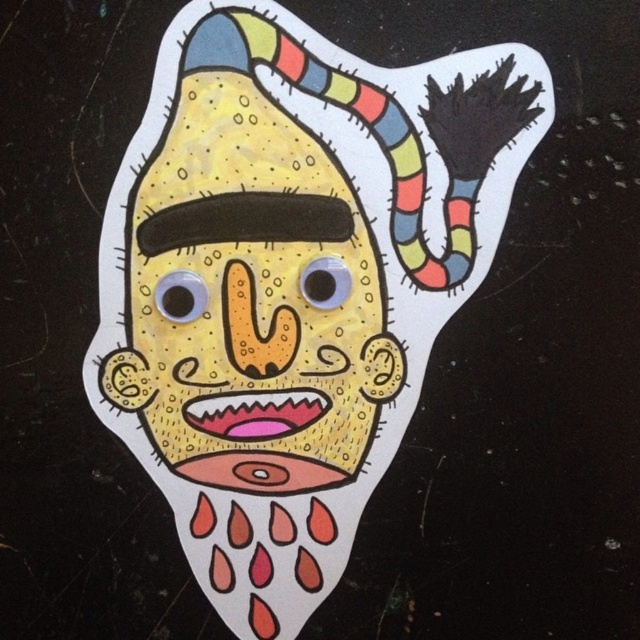
Question: Which object is closer to the camera taking this photo?

Choices:
 (A) yellow textured face at center
 (B) matte yellow mask at center

Answer: (B)

Question: Does matte yellow mask at center have a larger size compared to yellow textured face at center?

Choices:
 (A) no
 (B) yes

Answer: (B)

Question: Is matte yellow mask at center further to the viewer compared to yellow textured face at center?

Choices:
 (A) yes
 (B) no

Answer: (B)

Question: Does matte yellow mask at center come in front of yellow textured face at center?

Choices:
 (A) yes
 (B) no

Answer: (A)